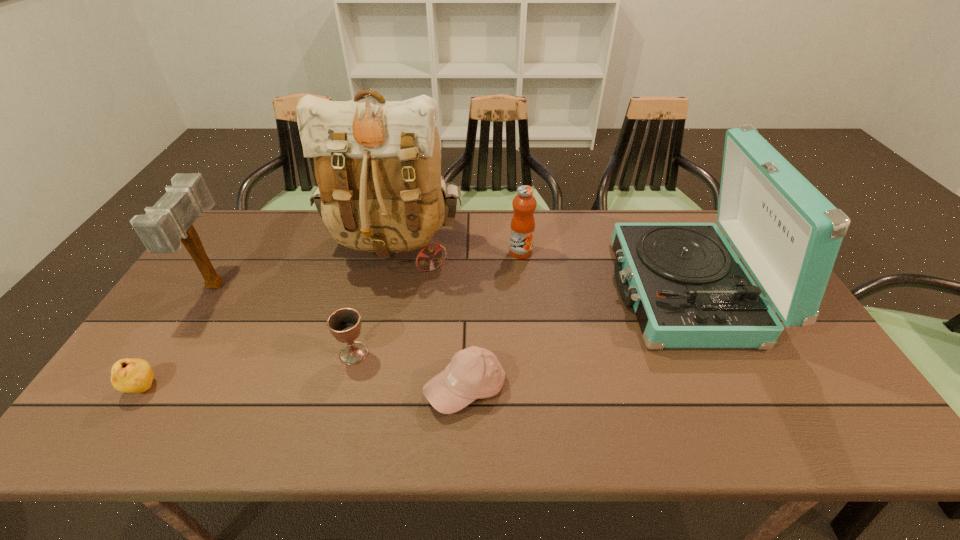
You are a GUI agent. You are given a task and a screenshot of the screen. Output one action in this format:
    pyautogui.click(x=<x>, y=<y>)
    Task: Click on the object that is positioned at the near edge
    This screenshot has height=540, width=960.
    Given the screenshot: What is the action you would take?
    pyautogui.click(x=474, y=373)

Find the location of `mallet that is at the left edge`. mallet that is at the left edge is located at coordinates 169,222.

Locate an element on the screen. The width and height of the screenshot is (960, 540). pear that is at the left edge is located at coordinates (128, 375).

The image size is (960, 540). I want to click on object at the right edge, so click(x=688, y=288).

At what (x,y) coordinates should I click in order to perform the action: click on object present at the far right corner. Please return your answer as a coordinate pair (x, y). Looking at the image, I should click on click(688, 288).

This screenshot has width=960, height=540. What are the coordinates of `vacant area at the far edge` in the screenshot? It's located at (307, 230).

Locate an element on the screen. vacant area at the near edge is located at coordinates click(x=202, y=416).

I want to click on free space at the left edge of the desktop, so [x=250, y=266].

You are a GUI agent. You are given a task and a screenshot of the screen. Output one action in this format:
    pyautogui.click(x=<x>, y=<y>)
    Task: Click on the vacant space at the right edge of the desktop
    Image resolution: width=960 pixels, height=540 pixels.
    Given the screenshot: What is the action you would take?
    pyautogui.click(x=799, y=375)

The image size is (960, 540). I want to click on free region at the far left corner of the desktop, so click(252, 242).